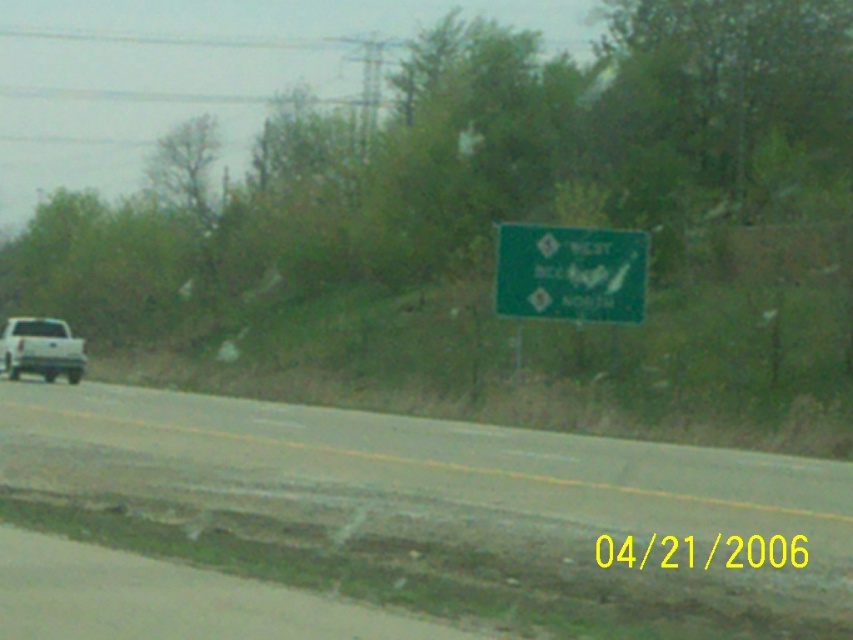
Who is lower down, gray asphalt road at center or white matte truck at left?

gray asphalt road at center is below.

Who is positioned more to the left, gray asphalt road at center or white matte truck at left?

From the viewer's perspective, white matte truck at left appears more on the left side.

Who is more forward, [358,561] or [18,376]?

Point [358,561] is more forward.

This screenshot has height=640, width=853. Identify the location of gray asphalt road at center. (390, 525).

I want to click on green matte sign at upper center, so click(x=570, y=273).

Between green matte sign at upper center and white matte truck at left, which one is positioned higher?

green matte sign at upper center is higher up.

Does point (613, 250) come in front of point (30, 326)?

Yes, point (613, 250) is in front of point (30, 326).

Locate an element on the screen. The width and height of the screenshot is (853, 640). green matte sign at upper center is located at coordinates (570, 273).

Can you confirm if gray asphalt road at center is wider than green matte sign at upper center?

Yes.

Who is more forward, (x=469, y=522) or (x=578, y=246)?

Point (x=469, y=522) is more forward.

The image size is (853, 640). I want to click on gray asphalt road at center, so click(x=390, y=525).